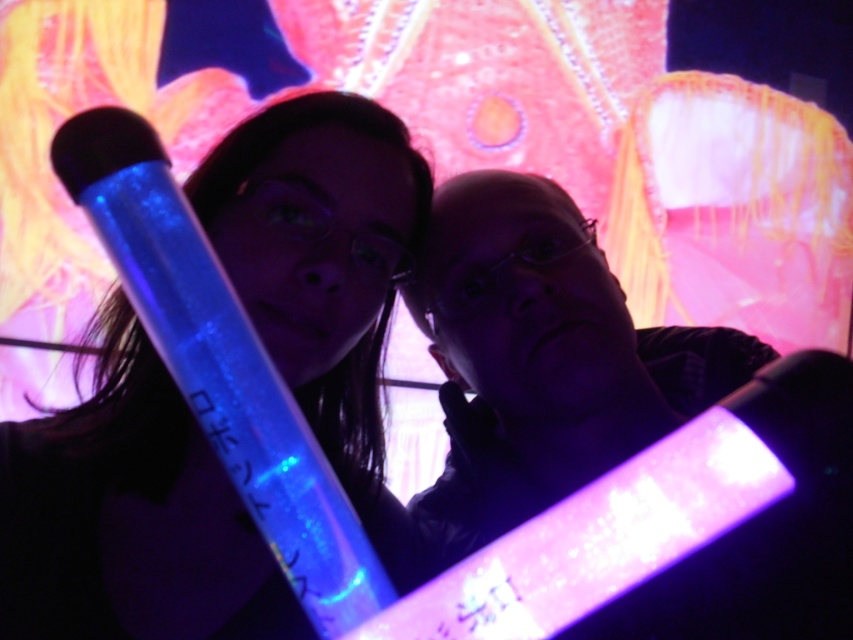
You are at a concert and holding a glowing plastic stick. There is a stage with a spotlight at point (129, 515). If you want to point your stick towards the spotlight, which direction should you move your hand?

The point (129, 515) corresponds to the glowing plastic stick at center, so you are already pointing it towards the spotlight.

You are at a concert holding a glowing plastic stick at center and a translucent plastic tube at center. You want to place both items on a shelf that can only hold one item at a time. Which item should you place first if you want to place the one that is lower in the image first?

The glowing plastic stick at center is located below the translucent plastic tube at center, so you should place the glowing plastic stick at center first.

You are at a concert holding a glowing plastic stick at center and a translucent plastic tube at center. You want to hand both items to a friend standing 12 inches away from you. Can you reach them without moving closer?

The glowing plastic stick at center is 11.80 inches from the translucent plastic tube at center, so yes, you can reach them both as the distance between the items is slightly less than 12 inches, allowing you to hand them over without moving closer.